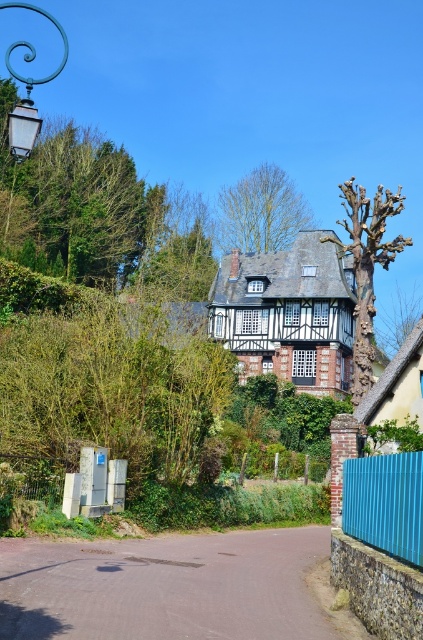
Does point (417, 456) come behind point (360, 369)?

No, it is not.

Who is positioned more to the left, blue corrugated metal fence at lower right or bare wood tree at right?

blue corrugated metal fence at lower right

Describe the element at coordinates (386, 502) in the screenshot. The height and width of the screenshot is (640, 423). I see `blue corrugated metal fence at lower right` at that location.

Where is `blue corrugated metal fence at lower right`? blue corrugated metal fence at lower right is located at coordinates (386, 502).

Does bare wood tree at right appear on the left side of teal wrought iron lamp post at upper left?

Incorrect, bare wood tree at right is not on the left side of teal wrought iron lamp post at upper left.

Can you confirm if bare wood tree at right is positioned above teal wrought iron lamp post at upper left?

Incorrect, bare wood tree at right is not positioned above teal wrought iron lamp post at upper left.

At what (x,y) coordinates should I click in order to perform the action: click on bare wood tree at right. Please return your answer as a coordinate pair (x, y). Looking at the image, I should click on (367, 266).

Identify the location of bare wood tree at right. The height and width of the screenshot is (640, 423). (367, 266).

What do you see at coordinates (367, 266) in the screenshot? The width and height of the screenshot is (423, 640). I see `bare wood tree at right` at bounding box center [367, 266].

Is bare wood tree at right smaller than green leafy tree at center?

Incorrect, bare wood tree at right is not smaller in size than green leafy tree at center.

Is point (370, 257) positioned behind point (255, 186)?

No, it is in front of (255, 186).

I want to click on bare wood tree at right, so tap(367, 266).